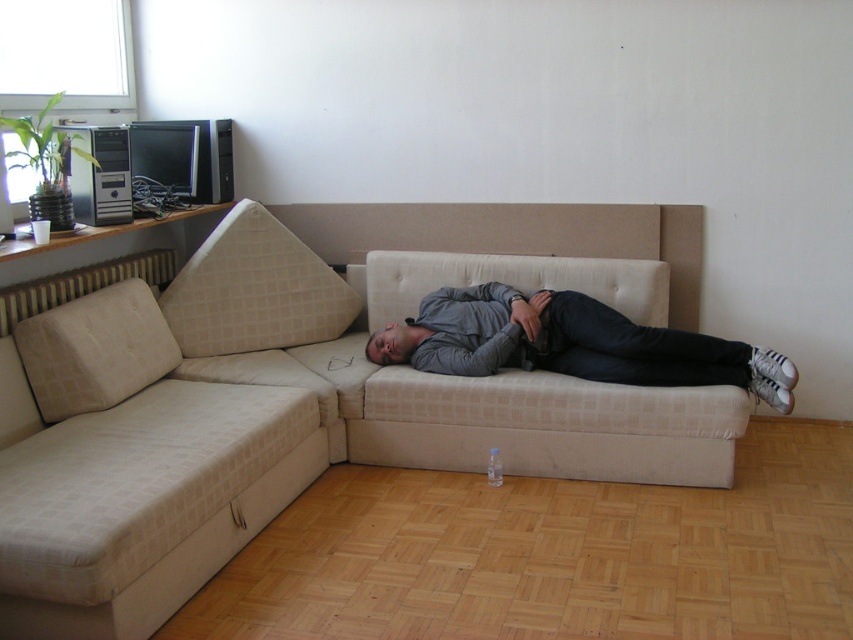
Question: Which object is positioned farthest from the matte gray head at center?

Choices:
 (A) gray cotton shirt at center
 (B) beige fabric pillow at left
 (C) beige fabric couch at center

Answer: (B)

Question: Which object appears farthest from the camera in this image?

Choices:
 (A) gray cotton shirt at center
 (B) beige fabric couch at center

Answer: (A)

Question: Does beige fabric couch at center appear under beige fabric pillow at left?

Choices:
 (A) no
 (B) yes

Answer: (B)

Question: Which point is closer to the camera?

Choices:
 (A) (548, 337)
 (B) (68, 570)

Answer: (B)

Question: In this image, where is gray cotton shirt at center located relative to beige fabric pillow at left?

Choices:
 (A) left
 (B) right

Answer: (B)

Question: Does beige fabric couch at center lie behind matte gray head at center?

Choices:
 (A) no
 (B) yes

Answer: (A)